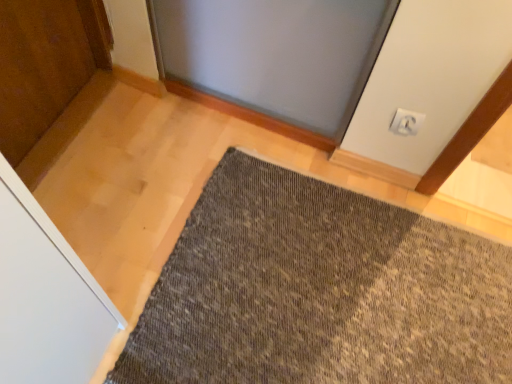
You are a GUI agent. You are given a task and a screenshot of the screen. Output one action in this format:
    pyautogui.click(x=<x>, y=<y>)
    Task: Click on the white plastic electric outlet at upper right
    
    Given the screenshot: What is the action you would take?
    pyautogui.click(x=406, y=122)

What do you see at coordinates (406, 122) in the screenshot? I see `white plastic electric outlet at upper right` at bounding box center [406, 122].

The width and height of the screenshot is (512, 384). What do you see at coordinates (320, 291) in the screenshot? I see `textured gray mat at center` at bounding box center [320, 291].

This screenshot has height=384, width=512. I want to click on textured gray mat at center, so click(x=320, y=291).

Identify the location of white plastic electric outlet at upper right. The height and width of the screenshot is (384, 512). (406, 122).

Would you say white plastic electric outlet at upper right is to the left or to the right of textured gray mat at center in the picture?

From the image, it's evident that white plastic electric outlet at upper right is to the right of textured gray mat at center.

Is white plastic electric outlet at upper right in front of or behind textured gray mat at center in the image?

white plastic electric outlet at upper right is behind textured gray mat at center.

Does point (397, 126) appear closer or farther from the camera than point (204, 304)?

Clearly, point (397, 126) is more distant from the camera than point (204, 304).

From the image's perspective, does white plastic electric outlet at upper right appear lower than textured gray mat at center?

No, from the image's perspective, white plastic electric outlet at upper right is not below textured gray mat at center.

From a real-world perspective, who is located lower, white plastic electric outlet at upper right or textured gray mat at center?

textured gray mat at center is physically lower.

Considering the relative sizes of white plastic electric outlet at upper right and textured gray mat at center in the image provided, is white plastic electric outlet at upper right thinner than textured gray mat at center?

Indeed, white plastic electric outlet at upper right has a lesser width compared to textured gray mat at center.

Considering the sizes of objects white plastic electric outlet at upper right and textured gray mat at center in the image provided, who is taller, white plastic electric outlet at upper right or textured gray mat at center?

Standing taller between the two is white plastic electric outlet at upper right.

Between white plastic electric outlet at upper right and textured gray mat at center, which one has smaller size?

Smaller between the two is white plastic electric outlet at upper right.

Is white plastic electric outlet at upper right spatially inside textured gray mat at center, or outside of it?

white plastic electric outlet at upper right cannot be found inside textured gray mat at center.

Is white plastic electric outlet at upper right with textured gray mat at center?

No, white plastic electric outlet at upper right is not touching textured gray mat at center.

Is white plastic electric outlet at upper right looking in the opposite direction of textured gray mat at center?

No, white plastic electric outlet at upper right's orientation is not away from textured gray mat at center.

How many degrees apart are the facing directions of white plastic electric outlet at upper right and textured gray mat at center?

They differ by 88.9 degrees in their facing directions.

How much distance is there between white plastic electric outlet at upper right and textured gray mat at center?

A distance of 23.13 inches exists between white plastic electric outlet at upper right and textured gray mat at center.

Locate an element on the screen. The width and height of the screenshot is (512, 384). mat to the left of white plastic electric outlet at upper right is located at coordinates (320, 291).

Is textured gray mat at center to the left of white plastic electric outlet at upper right from the viewer's perspective?

Yes, textured gray mat at center is to the left of white plastic electric outlet at upper right.

Does textured gray mat at center come in front of white plastic electric outlet at upper right?

Yes, it is.

Is point (446, 355) behind point (403, 109)?

No, it is in front of (403, 109).

From the image's perspective, is textured gray mat at center positioned above or below white plastic electric outlet at upper right?

textured gray mat at center is situated lower than white plastic electric outlet at upper right in the image.

From a real-world perspective, is textured gray mat at center physically below white plastic electric outlet at upper right?

Indeed, from a real-world perspective, textured gray mat at center is positioned beneath white plastic electric outlet at upper right.

In the scene shown: Can you confirm if textured gray mat at center is wider than white plastic electric outlet at upper right?

Correct, the width of textured gray mat at center exceeds that of white plastic electric outlet at upper right.

Does textured gray mat at center have a greater height compared to white plastic electric outlet at upper right?

Incorrect, the height of textured gray mat at center is not larger of that of white plastic electric outlet at upper right.

Which of these two, textured gray mat at center or white plastic electric outlet at upper right, is smaller?

white plastic electric outlet at upper right.

Is textured gray mat at center inside the boundaries of white plastic electric outlet at upper right, or outside?

textured gray mat at center exists outside the volume of white plastic electric outlet at upper right.

Would you say textured gray mat at center is a long distance from white plastic electric outlet at upper right?

No, textured gray mat at center is not far away from white plastic electric outlet at upper right.

Is textured gray mat at center oriented away from white plastic electric outlet at upper right?

textured gray mat at center does not have its back to white plastic electric outlet at upper right.

Can you tell me how much textured gray mat at center and white plastic electric outlet at upper right differ in facing direction?

The angular difference between textured gray mat at center and white plastic electric outlet at upper right is 88.9 degrees.

Identify the location of electric outlet behind the textured gray mat at center. [406, 122].

The height and width of the screenshot is (384, 512). I want to click on electric outlet behind the textured gray mat at center, so click(x=406, y=122).

I want to click on electric outlet that is on the right side of textured gray mat at center, so click(x=406, y=122).